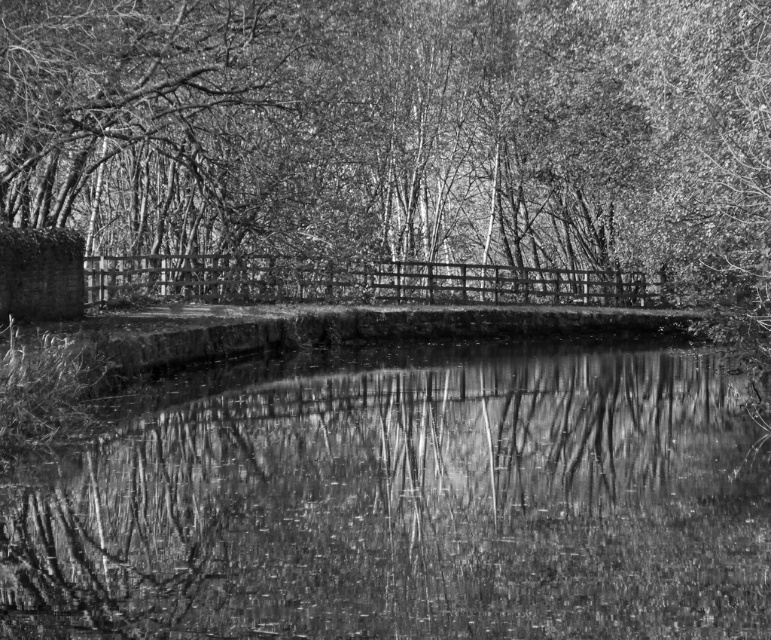
Is the position of smooth water at center more distant than that of wooden bridge at center?

No, smooth water at center is in front of wooden bridge at center.

Is smooth water at center smaller than wooden bridge at center?

Correct, smooth water at center occupies less space than wooden bridge at center.

Who is more distant from viewer, (480, 360) or (403, 289)?

The point (403, 289) is more distant.

Locate an element on the screen. The width and height of the screenshot is (771, 640). smooth water at center is located at coordinates (412, 509).

Who is positioned more to the left, rough bark tree at center or smooth water at center?

From the viewer's perspective, smooth water at center appears more on the left side.

From the picture: Who is lower down, rough bark tree at center or smooth water at center?

Positioned lower is smooth water at center.

Measure the distance between rough bark tree at center and camera.

rough bark tree at center and camera are 16.65 meters apart from each other.

The width and height of the screenshot is (771, 640). Identify the location of rough bark tree at center. (396, 129).

In the scene shown: Is rough bark tree at center thinner than wooden bridge at center?

No.

Who is more distant from viewer, (711, 232) or (96, 284)?

The point (96, 284) is more distant.

At what (x,y) coordinates should I click in order to perform the action: click on rough bark tree at center. Please return your answer as a coordinate pair (x, y). The width and height of the screenshot is (771, 640). Looking at the image, I should click on (396, 129).